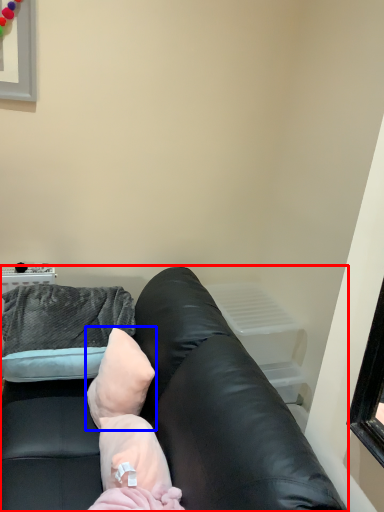
Question: Which of the following is the farthest to the observer, studio couch (highlighted by a red box) or pillow (highlighted by a blue box)?

Choices:
 (A) studio couch
 (B) pillow

Answer: (B)